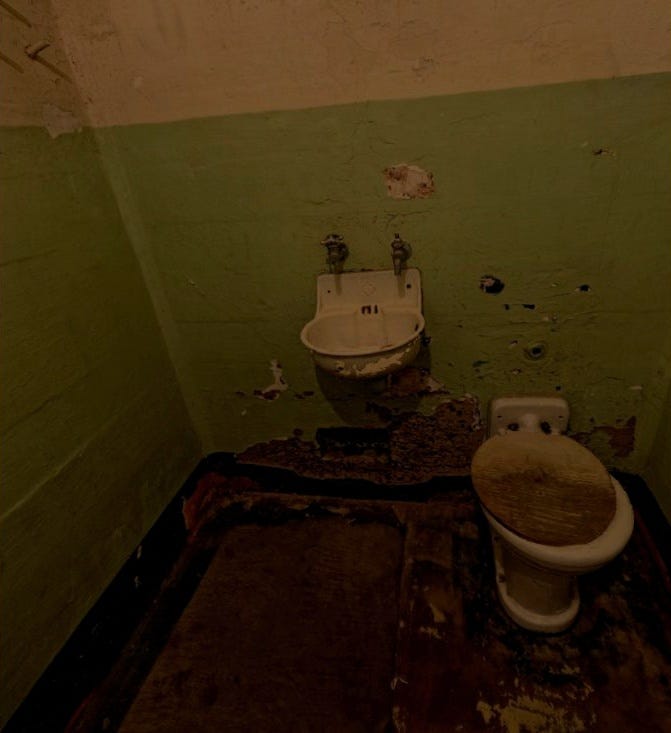
Locate an element on the screen. Image resolution: width=671 pixels, height=733 pixels. floor is located at coordinates (345, 682).